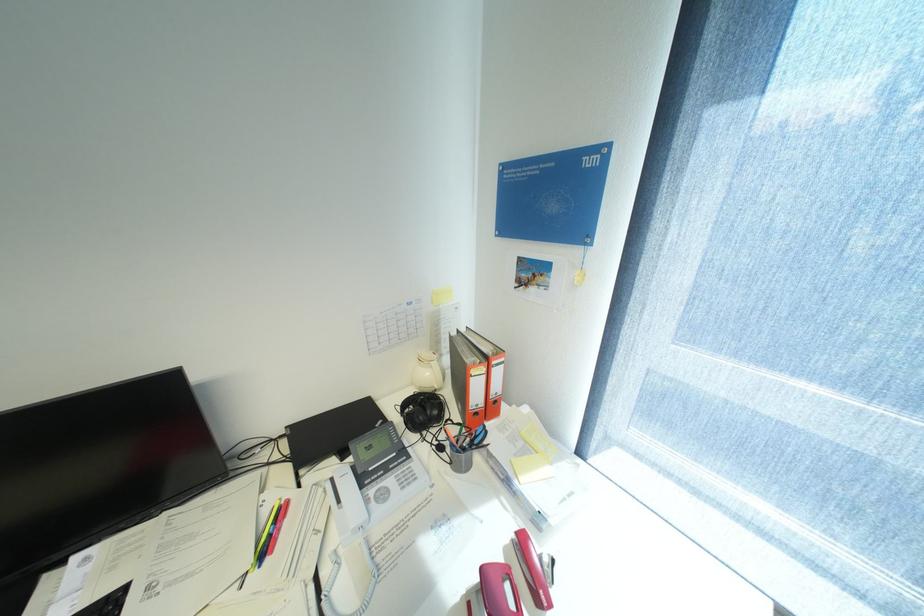
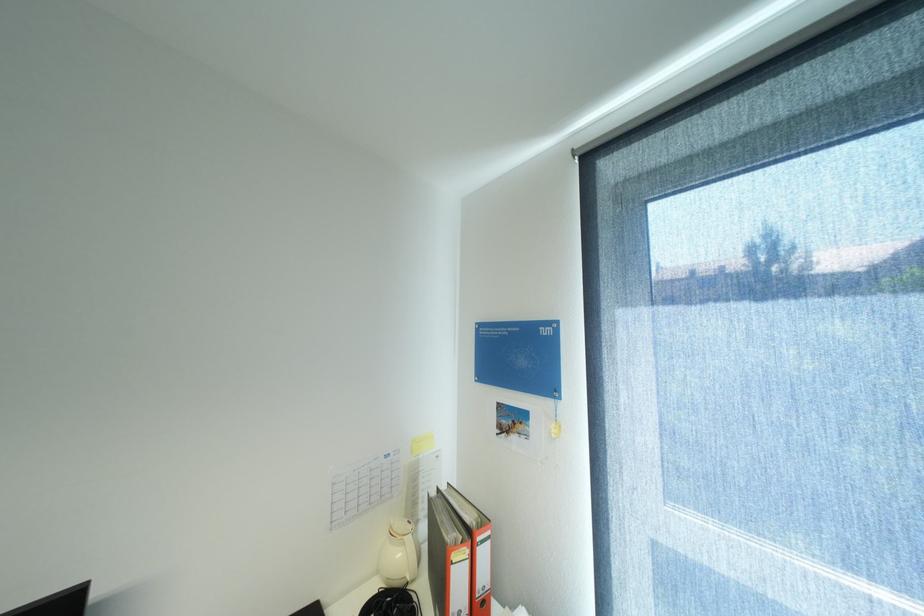
In the second image, find the point that corresponds to point 436,374 in the first image.

(407, 554)